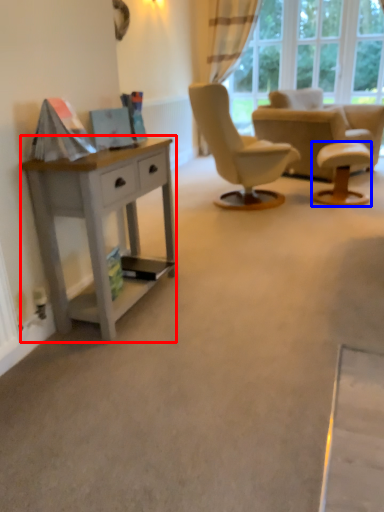
Question: Which point is further to the camera, desk (highlighted by a red box) or stool (highlighted by a blue box)?

Choices:
 (A) desk
 (B) stool

Answer: (B)